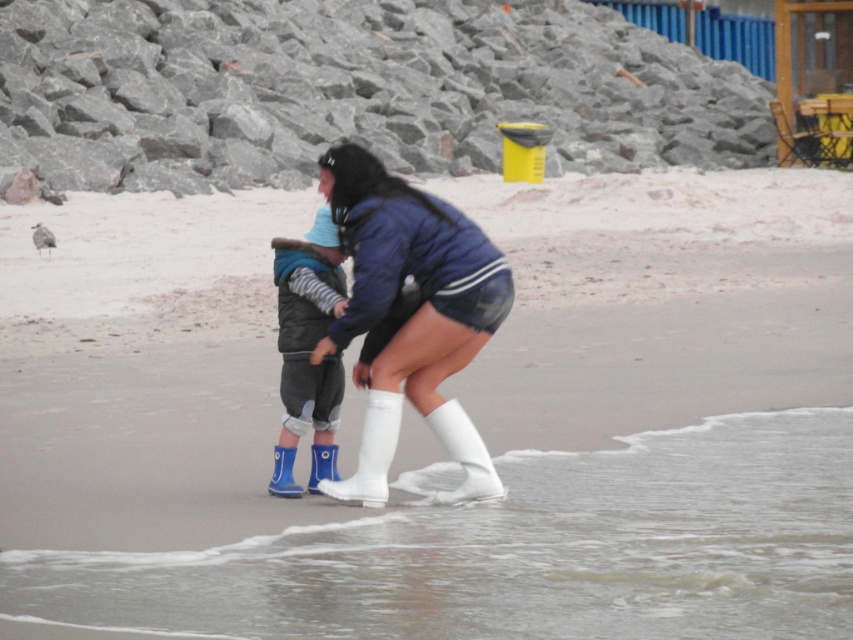
You are standing on the beach and want to place a small flag at the point that is closer to you. Which point should you choose between point (309, 157) and point (291, 460)?

Point (291, 460) is closer to you, so you should place the flag there.

You are a photographer trying to capture a closeup of the smooth sand at lower center without the white matte socks at lower center appearing in the frame. Given their positions, can you fit the sand into the shot while excluding the socks?

The smooth sand at lower center has a larger width than the white matte socks at lower center. Since the sand is wider, you can adjust the camera angle to focus on the broader area of the sand while excluding the narrower socks.